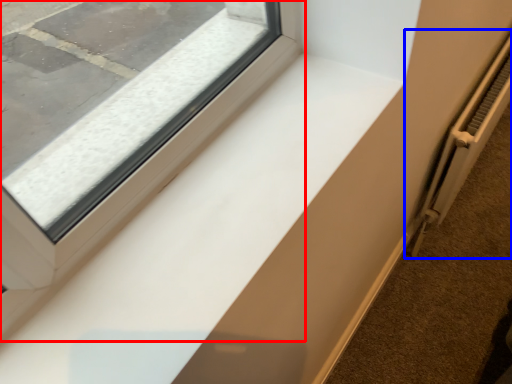
Question: Among these objects, which one is nearest to the camera, window (highlighted by a red box) or radiator (highlighted by a blue box)?

Choices:
 (A) window
 (B) radiator

Answer: (A)